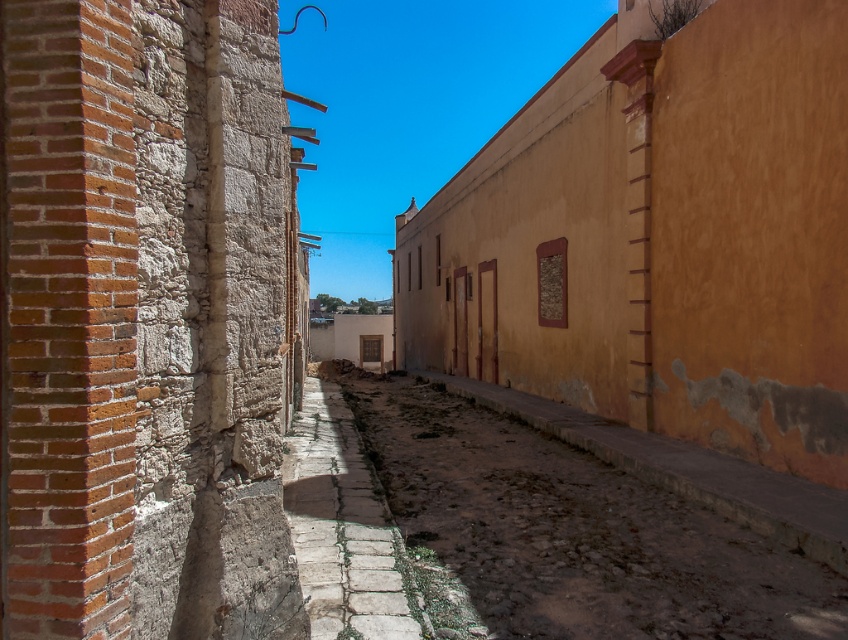
You are a delivery person trying to navigate through the alleyway. You notice two paths at the center of the image. Which path, the dirt cobblestone path at center or the stone paved path at center, is lower in elevation?

The dirt cobblestone path at center is not as tall as the stone paved path at center, so the dirt cobblestone path at center is lower in elevation.

From the picture: You are a delivery person trying to navigate through the alleyway. You see both the dirt cobblestone path at center and the stone paved path at center. Which path is closer to you as you enter the alleyway?

→ The dirt cobblestone path at center is closer to you as you enter the alleyway because the stone paved path at center is positioned behind it.